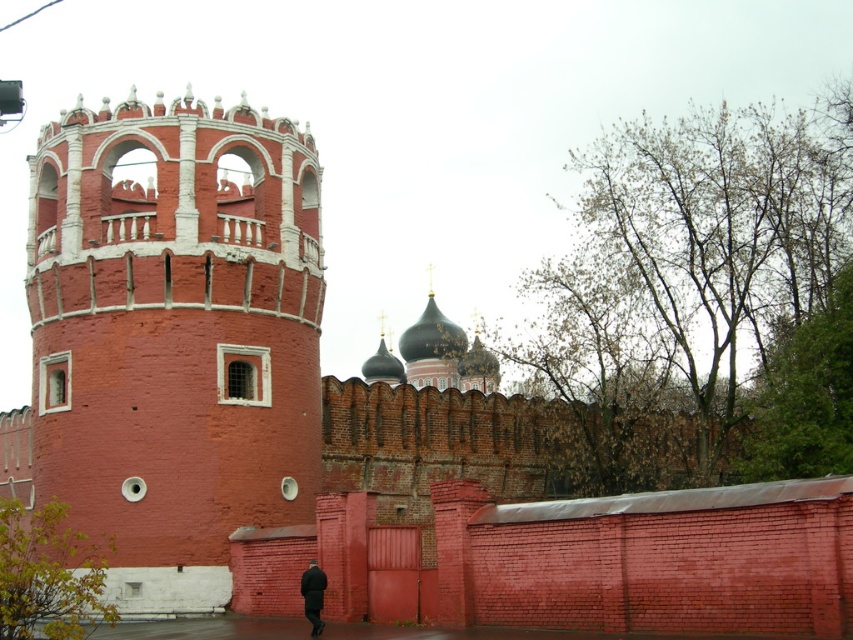
Is smooth brick tower at center to the right of black matte coat at lower center from the viewer's perspective?

Incorrect, smooth brick tower at center is not on the right side of black matte coat at lower center.

Is smooth brick tower at center below black matte coat at lower center?

Incorrect, smooth brick tower at center is not positioned below black matte coat at lower center.

Looking at this image, who is more forward, (258, 221) or (300, 588)?

Point (300, 588) is in front.

Where is `smooth brick tower at center`? The width and height of the screenshot is (853, 640). smooth brick tower at center is located at coordinates (171, 339).